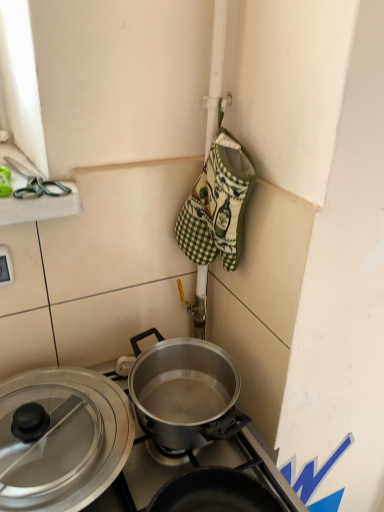
Question: Visually, is white plastic electric outlet at lower left positioned to the left or to the right of polished silver pot at center?

Choices:
 (A) right
 (B) left

Answer: (B)

Question: From the image's perspective, is white plastic electric outlet at lower left positioned above or below polished silver pot at center?

Choices:
 (A) above
 (B) below

Answer: (A)

Question: Which is nearer to the transparent glass lid at lower left?

Choices:
 (A) white plastic electric outlet at lower left
 (B) green plastic scissors at upper left
 (C) polished silver pot at center
 (D) green checkered oven mitt at center

Answer: (C)

Question: Considering the real-world distances, which object is farthest from the white plastic electric outlet at lower left?

Choices:
 (A) green plastic scissors at upper left
 (B) polished silver pot at center
 (C) green checkered oven mitt at center
 (D) transparent glass lid at lower left

Answer: (C)